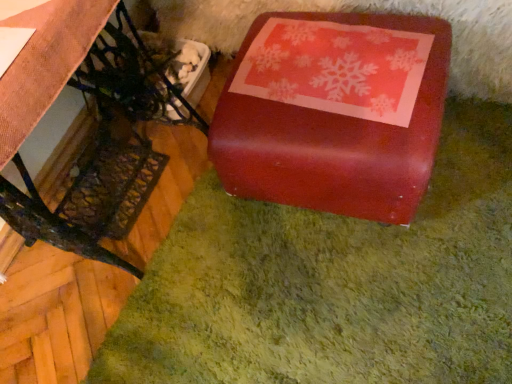
The height and width of the screenshot is (384, 512). I want to click on vacant space in front of glossy red box at center, so click(x=378, y=285).